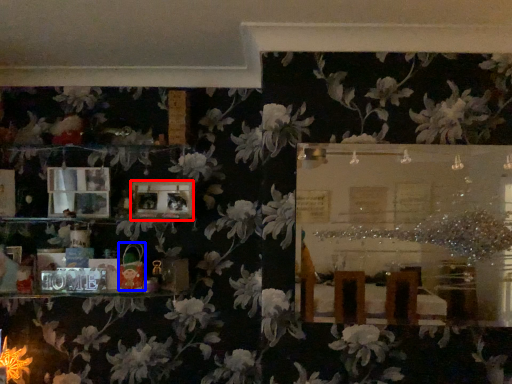
Question: Among these objects, which one is farthest to the camera, picture frame (highlighted by a red box) or toy (highlighted by a blue box)?

Choices:
 (A) picture frame
 (B) toy

Answer: (A)